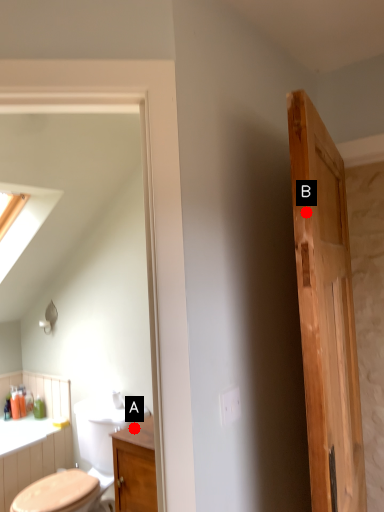
Question: Two points are circled on the image, labeled by A and B beside each circle. Which of the following is the farthest from the observer?

Choices:
 (A) A is further
 (B) B is further

Answer: (A)